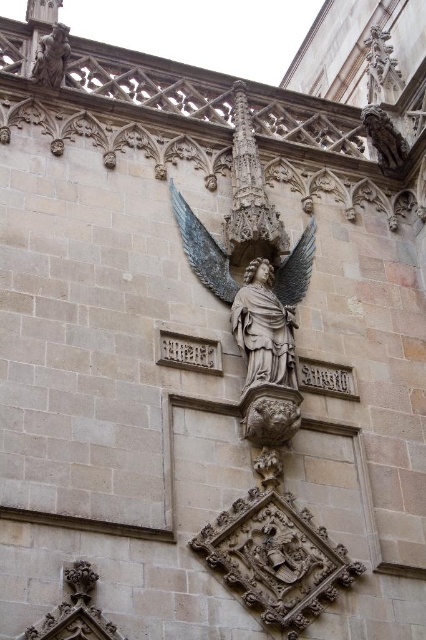
You are an architect examining the Gothic facade and notice the polished stone angel at center and the satin gold wings at center. Which object has a greater width when viewed from the front?

The satin gold wings at center are wider than the polished stone angel at center, so the satin gold wings at center have a greater width when viewed from the front.

You are an architect examining the Gothic facade. You notice the polished bronze wing at center and the matte stone angel at upper left. Which object has a smaller width?

The polished bronze wing at center has a lesser width compared to the matte stone angel at upper left.

You are standing in front of the Gothic facade and notice two points marked on the wall. The first point is at coordinates point (244, 337) and the second is at point (294, 288). Which of these two points is nearer to your current viewpoint?

Point (244, 337) is closer to the camera than point (294, 288), so the first point is nearer to your viewpoint.